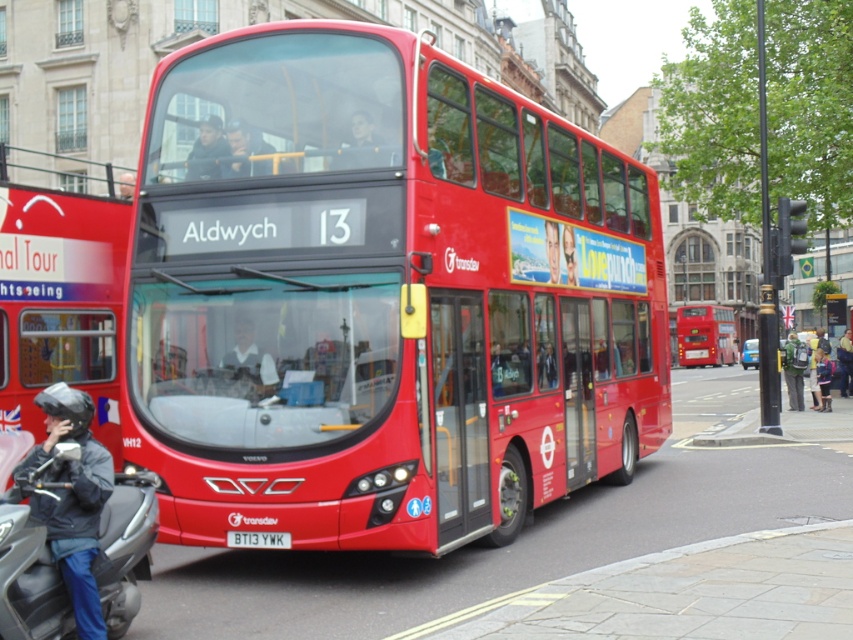
You are a tourist in London and see two red buses in the scene. The shiny red bus at center and the matte red bus at left. Which one is closer to you?

The shiny red bus at center is smaller than the matte red bus at left, so it is closer to you.

You are a photographer standing 20 feet away from the shiny red bus at center. You want to take a photo of it but realize your camera has a maximum focus range of 20 feet. Will you be able to capture the bus clearly?

The shiny red bus at center is 22.23 feet away from the camera, which exceeds the camera maximum focus range of 20 feet. Therefore, you won t be able to capture the bus clearly.

You are a delivery rider who needs to pick up a black leather helmet at lower left. The GPS shows your current position is at point (73, 499). Can you confirm if you are already at the correct location?

Yes, the point (73, 499) corresponds to the black leather helmet at lower left, so you are already at the correct location.